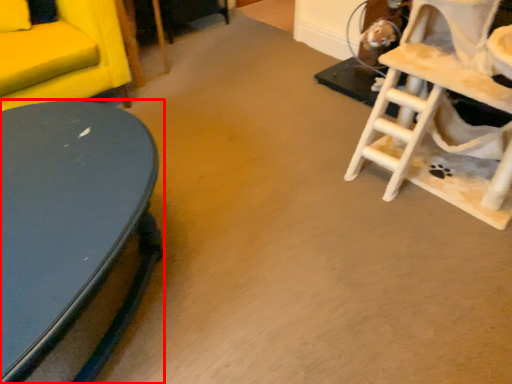
Question: Observing the image, what is the correct spatial positioning of table (annotated by the red box) in reference to rocking chair?

Choices:
 (A) right
 (B) left

Answer: (B)